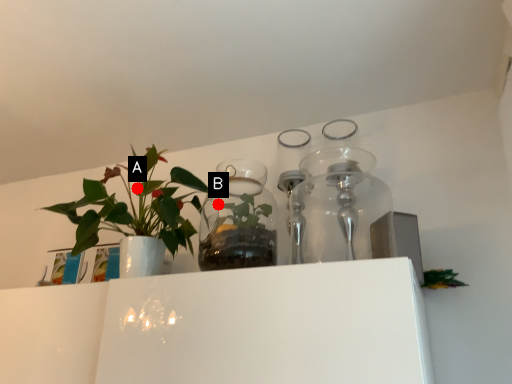
Question: Two points are circled on the image, labeled by A and B beside each circle. Among these points, which one is farthest from the camera?

Choices:
 (A) A is further
 (B) B is further

Answer: (A)